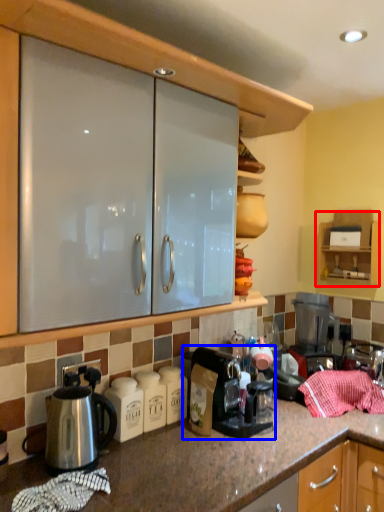
Question: Among these objects, which one is nearest to the camera, cabinetry (highlighted by a red box) or coffee maker (highlighted by a blue box)?

Choices:
 (A) cabinetry
 (B) coffee maker

Answer: (B)